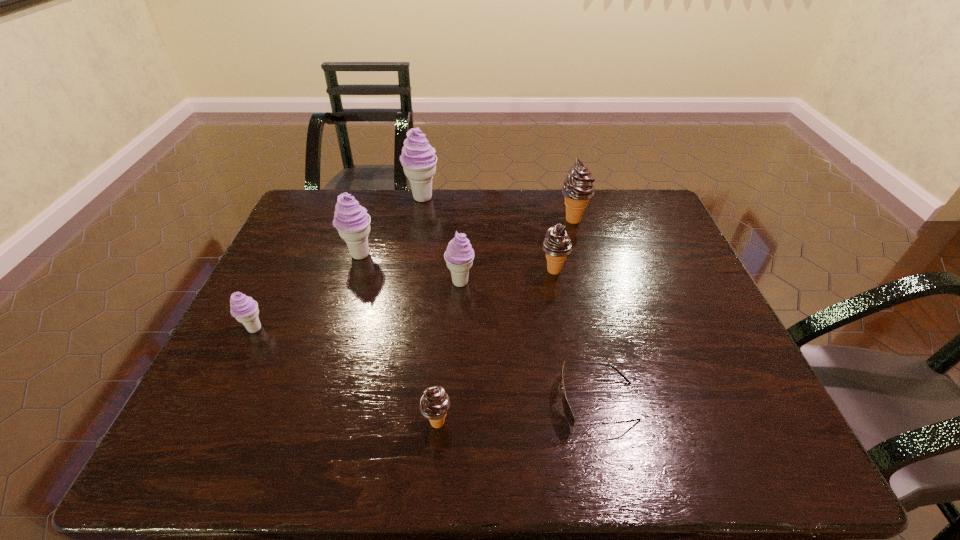
Find the location of a particular element. The height and width of the screenshot is (540, 960). vacant space that's between the farthest chocolate icecream and the third icecream from left to right is located at coordinates 497,208.

Locate an element on the screen. vacant point located between the tallest icecream and the sixth farthest icecream is located at coordinates (339, 264).

Locate an element on the screen. The width and height of the screenshot is (960, 540). empty location between the tallest object and the sunglasses is located at coordinates (510, 300).

This screenshot has width=960, height=540. In order to click on object that ranks as the fourth closest to the second chocolate icecream from right to left in this screenshot , I will do `click(418, 158)`.

Find the location of a particular element. The image size is (960, 540). the seventh closest object to the second nearest chocolate icecream is located at coordinates (245, 310).

Identify the location of the third closest icecream to the second smallest purple icecream. (418, 158).

What are the coordinates of `icecream that is the sixth nearest to the second biggest purple icecream` in the screenshot? It's located at (578, 188).

Identify which purple icecream is the closest to the farthest purple icecream. Please provide its 2D coordinates. Your answer should be formatted as a tuple, i.e. [(x, y)], where the tuple contains the x and y coordinates of a point satisfying the conditions above.

[(351, 220)]

The height and width of the screenshot is (540, 960). Identify the location of the third closest purple icecream to the shortest object. (245, 310).

Find the location of a particular element. the second closest chocolate icecream to the second purple icecream from right to left is located at coordinates (557, 246).